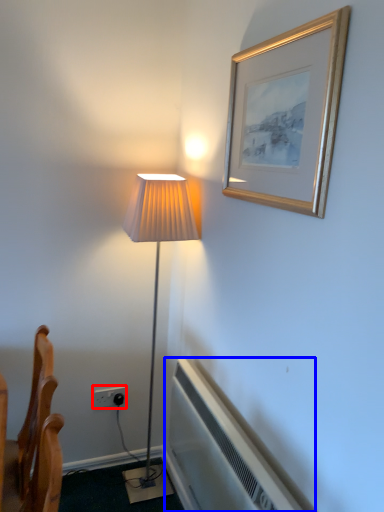
Question: Which point is further to the camera, electric outlet (highlighted by a red box) or air conditioner (highlighted by a blue box)?

Choices:
 (A) electric outlet
 (B) air conditioner

Answer: (A)